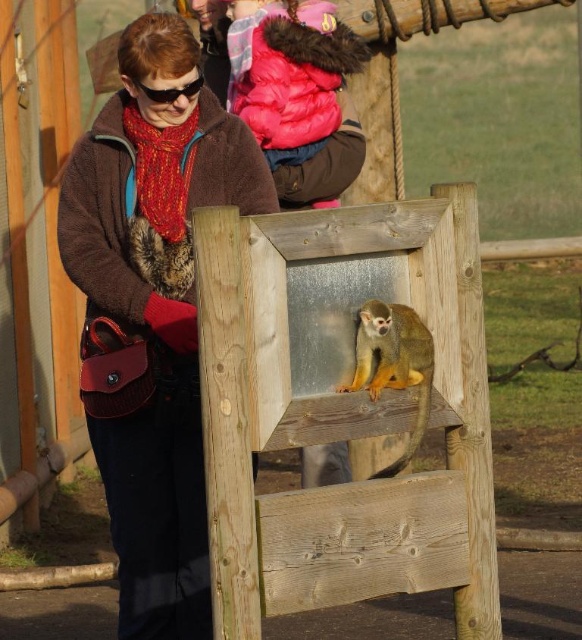
Question: Which is farther from the black plastic goggles at upper center?

Choices:
 (A) brown fuzzy jacket at upper left
 (B) golden fur monkey at center

Answer: (B)

Question: Is brown fuzzy jacket at upper left above black plastic goggles at upper center?

Choices:
 (A) yes
 (B) no

Answer: (B)

Question: Which object is positioned farthest from the brown fuzzy jacket at upper left?

Choices:
 (A) golden fur monkey at center
 (B) black plastic goggles at upper center

Answer: (A)

Question: Based on their relative distances, which object is nearer to the brown fuzzy jacket at upper left?

Choices:
 (A) black plastic goggles at upper center
 (B) golden fur monkey at center

Answer: (A)

Question: Can you confirm if golden fur monkey at center is positioned to the right of black plastic goggles at upper center?

Choices:
 (A) no
 (B) yes

Answer: (B)

Question: Can you confirm if brown fuzzy jacket at upper left is bigger than golden fur monkey at center?

Choices:
 (A) yes
 (B) no

Answer: (A)